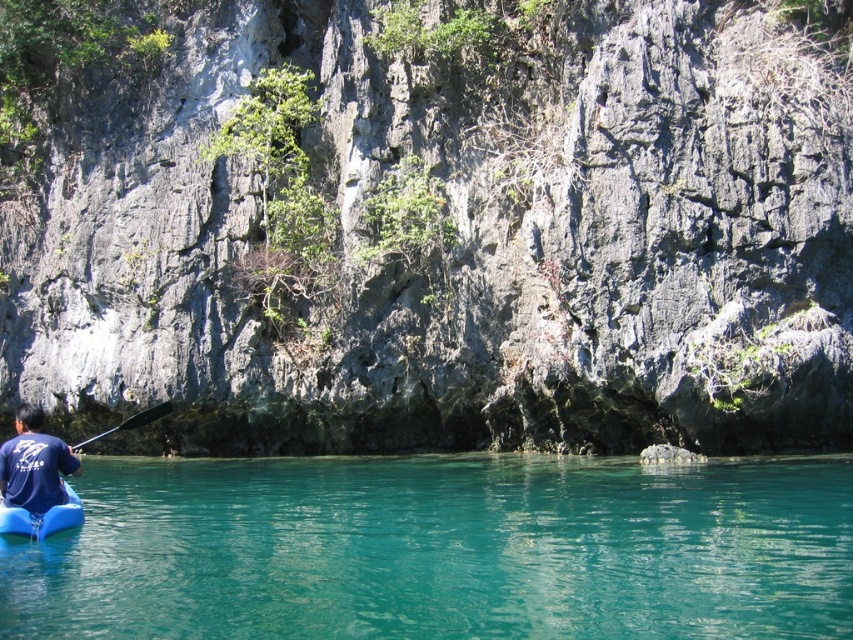
Question: Is gray rock cliff at upper center below black rubber paddle at lower left?

Choices:
 (A) no
 (B) yes

Answer: (A)

Question: Which point appears farthest from the camera in this image?

Choices:
 (A) (566, 497)
 (B) (125, 422)

Answer: (B)

Question: Can you confirm if teal glossy water at lower center is positioned to the left of black rubber paddle at lower left?

Choices:
 (A) no
 (B) yes

Answer: (A)

Question: Which object appears farthest from the camera in this image?

Choices:
 (A) blue fabric kayak at lower left
 (B) gray rock cliff at upper center

Answer: (B)

Question: Among these objects, which one is nearest to the camera?

Choices:
 (A) gray rock cliff at upper center
 (B) black rubber paddle at lower left
 (C) blue rubber canoe at lower left

Answer: (C)

Question: Does blue fabric kayak at lower left appear on the right side of blue rubber canoe at lower left?

Choices:
 (A) no
 (B) yes

Answer: (A)